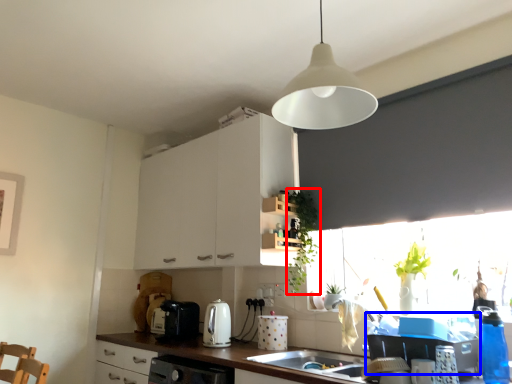
Question: Which of the following is the closest to the observer, plant (highlighted by a red box) or appliance (highlighted by a blue box)?

Choices:
 (A) plant
 (B) appliance

Answer: (B)